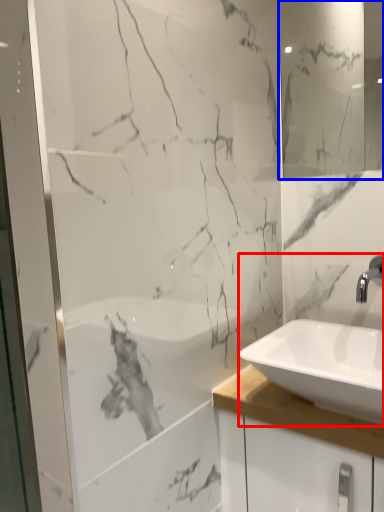
Question: Which of the following is the farthest to the observer, sink (highlighted by a red box) or mirror (highlighted by a blue box)?

Choices:
 (A) sink
 (B) mirror

Answer: (B)